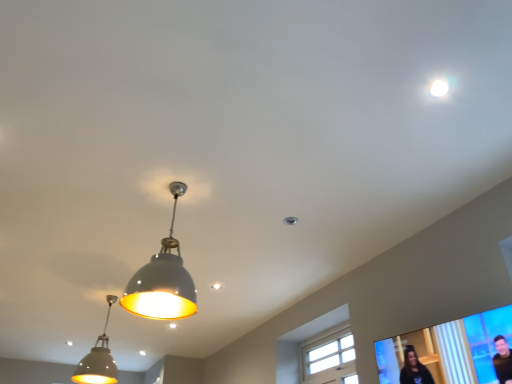
The width and height of the screenshot is (512, 384). Find the location of `matte black screen at lower right`. matte black screen at lower right is located at coordinates (452, 351).

Locate an element on the screen. white wood window at center is located at coordinates (328, 357).

This screenshot has height=384, width=512. I want to click on matte gray lampshade at center, which is the 2th lamp in back-to-front order, so click(x=163, y=280).

Which object is wider, white glossy droplight at upper right or matte black screen at lower right?

Wider between the two is matte black screen at lower right.

From a real-world perspective, does white glossy droplight at upper right stand above matte black screen at lower right?

Yes, from a real-world perspective, white glossy droplight at upper right is on top of matte black screen at lower right.

Looking at the image, does white glossy droplight at upper right seem bigger or smaller compared to matte black screen at lower right?

Considering their sizes, white glossy droplight at upper right takes up less space than matte black screen at lower right.

Is white glossy droplight at upper right next to matte black screen at lower right and touching it?

No, white glossy droplight at upper right is not in contact with matte black screen at lower right.

Is white glossy droplight at upper right at the back of matte gray pendant light at lower left, which is the 1th lamp from back to front?

No, matte gray pendant light at lower left, which is the 1th lamp from back to front, is not facing the opposite direction of white glossy droplight at upper right.

Which object is positioned more to the right, matte gray pendant light at lower left, which appears as the 1th lamp when ordered from the bottom, or white glossy droplight at upper right?

white glossy droplight at upper right.

Find the location of a particular element. lamp that is the 2nd one when counting backward from the white glossy droplight at upper right is located at coordinates (98, 359).

How many degrees apart are the facing directions of matte gray pendant light at lower left, which is counted as the second lamp, starting from the top, and white glossy droplight at upper right?

The angle between the facing direction of matte gray pendant light at lower left, which is counted as the second lamp, starting from the top, and the facing direction of white glossy droplight at upper right is 92.2 degrees.

Can you tell me how much white wood window at center and matte black screen at lower right differ in facing direction?

The angle between the facing direction of white wood window at center and the facing direction of matte black screen at lower right is 0.4 degrees.

Can you confirm if white wood window at center is taller than matte black screen at lower right?

Correct, white wood window at center is much taller as matte black screen at lower right.

Where is `projection screen on the right of white wood window at center`? The image size is (512, 384). projection screen on the right of white wood window at center is located at coordinates (452, 351).

Does white wood window at center contain matte black screen at lower right?

No.

Is matte gray pendant light at lower left, which appears as the 1th lamp when ordered from the bottom, oriented towards matte black screen at lower right?

No, matte gray pendant light at lower left, which appears as the 1th lamp when ordered from the bottom, is not oriented towards matte black screen at lower right.

Considering the points (94, 346) and (445, 342), which point is in front, point (94, 346) or point (445, 342)?

Point (445, 342)

From the image's perspective, would you say matte gray pendant light at lower left, which is counted as the second lamp, starting from the top, is positioned over matte black screen at lower right?

Actually, matte gray pendant light at lower left, which is counted as the second lamp, starting from the top, appears below matte black screen at lower right in the image.

Considering the positions of points (444, 90) and (125, 303), is point (444, 90) farther from camera compared to point (125, 303)?

No, (444, 90) is in front of (125, 303).

Would you say white glossy droplight at upper right is to the left or to the right of matte gray lampshade at center, which is the 2th lamp in back-to-front order, in the picture?

white glossy droplight at upper right is to the right of matte gray lampshade at center, which is the 2th lamp in back-to-front order.

Is white glossy droplight at upper right not within matte gray lampshade at center, which is the 2th lamp from left to right?

Indeed, white glossy droplight at upper right is completely outside matte gray lampshade at center, which is the 2th lamp from left to right.

From the picture: Considering the relative sizes of white glossy droplight at upper right and matte gray lampshade at center, which ranks as the 2th lamp in bottom-to-top order, in the image provided, is white glossy droplight at upper right shorter than matte gray lampshade at center, which ranks as the 2th lamp in bottom-to-top order,?

Indeed, white glossy droplight at upper right has a lesser height compared to matte gray lampshade at center, which ranks as the 2th lamp in bottom-to-top order.

Is matte gray lampshade at center, which ranks as the 2th lamp in bottom-to-top order, positioned beyond the bounds of white glossy droplight at upper right?

Yes.

Which of these two, matte gray lampshade at center, which is the 2th lamp from left to right, or white glossy droplight at upper right, is thinner?

white glossy droplight at upper right.

From the image's perspective, is matte gray lampshade at center, which is the 2th lamp in back-to-front order, located beneath white glossy droplight at upper right?

Correct, matte gray lampshade at center, which is the 2th lamp in back-to-front order, appears lower than white glossy droplight at upper right in the image.

Does matte gray lampshade at center, the first lamp when ordered from front to back, have a smaller size compared to matte black screen at lower right?

No, matte gray lampshade at center, the first lamp when ordered from front to back, is not smaller than matte black screen at lower right.

In the scene shown: Does matte gray lampshade at center, which is the 2th lamp in back-to-front order, contain matte black screen at lower right?

No, matte black screen at lower right is not surrounded by matte gray lampshade at center, which is the 2th lamp in back-to-front order.

Does matte gray lampshade at center, which ranks as the 2th lamp in bottom-to-top order, have a greater height compared to matte black screen at lower right?

Yes, matte gray lampshade at center, which ranks as the 2th lamp in bottom-to-top order, is taller than matte black screen at lower right.

Which object is positioned more to the right, matte gray lampshade at center, the first lamp when ordered from front to back, or matte black screen at lower right?

Positioned to the right is matte black screen at lower right.

You are a GUI agent. You are given a task and a screenshot of the screen. Output one action in this format:
    pyautogui.click(x=<x>, y=<y>)
    Task: Click on the droplight behind the matte black screen at lower right
    
    Given the screenshot: What is the action you would take?
    pyautogui.click(x=439, y=88)

At what (x,y) coordinates should I click in order to perform the action: click on droplight above the matte gray pendant light at lower left, which ranks as the 2th lamp in right-to-left order (from a real-world perspective). Please return your answer as a coordinate pair (x, y). The height and width of the screenshot is (384, 512). Looking at the image, I should click on (x=439, y=88).

Estimate the real-world distances between objects in this image. Which object is closer to matte black screen at lower right, white wood window at center or matte gray pendant light at lower left, which is counted as the first lamp, starting from the left?

Among the two, white wood window at center is located nearer to matte black screen at lower right.

Based on their spatial positions, is white wood window at center or matte gray lampshade at center, which ranks as the 2th lamp in bottom-to-top order, further from matte black screen at lower right?

white wood window at center is positioned further to the anchor matte black screen at lower right.

Which object lies further to the anchor point white glossy droplight at upper right, white wood window at center or matte black screen at lower right?

Based on the image, white wood window at center appears to be further to white glossy droplight at upper right.

Looking at the image, which one is located closer to matte gray pendant light at lower left, which is counted as the first lamp, starting from the left, matte black screen at lower right or white wood window at center?

Among the two, white wood window at center is located nearer to matte gray pendant light at lower left, which is counted as the first lamp, starting from the left.

Estimate the real-world distances between objects in this image. Which object is closer to white glossy droplight at upper right, matte black screen at lower right or matte gray pendant light at lower left, which is the 1th lamp from back to front?

matte black screen at lower right is positioned closer to the anchor white glossy droplight at upper right.

Considering their positions, is matte black screen at lower right positioned closer to white wood window at center than matte gray pendant light at lower left, which is counted as the second lamp, starting from the top?

Among the two, matte black screen at lower right is located nearer to white wood window at center.

From the image, which object appears to be nearer to matte black screen at lower right, matte gray lampshade at center, arranged as the first lamp when viewed from the top, or white glossy droplight at upper right?

Among the two, white glossy droplight at upper right is located nearer to matte black screen at lower right.

Looking at the image, which one is located further to matte gray lampshade at center, arranged as the first lamp when viewed from the top, white glossy droplight at upper right or matte gray pendant light at lower left, which ranks as the 2th lamp in right-to-left order?

Based on the image, matte gray pendant light at lower left, which ranks as the 2th lamp in right-to-left order, appears to be further to matte gray lampshade at center, arranged as the first lamp when viewed from the top.

You are a GUI agent. You are given a task and a screenshot of the screen. Output one action in this format:
    pyautogui.click(x=<x>, y=<y>)
    Task: Click on the lamp located between matte gray pendant light at lower left, marked as the 2th lamp in a front-to-back arrangement, and white glossy droplight at upper right in the left-right direction
    The image size is (512, 384).
    Given the screenshot: What is the action you would take?
    pyautogui.click(x=163, y=280)

This screenshot has height=384, width=512. In order to click on window between matte gray pendant light at lower left, which is counted as the second lamp, starting from the top, and matte black screen at lower right from left to right in this screenshot , I will do `click(328, 357)`.

Identify the location of droplight between matte gray lampshade at center, which is the 2th lamp from left to right, and matte black screen at lower right, in the horizontal direction. (439, 88).

Find the location of a particular element. Image resolution: width=512 pixels, height=384 pixels. lamp between matte gray pendant light at lower left, marked as the 2th lamp in a front-to-back arrangement, and white wood window at center is located at coordinates tap(163, 280).